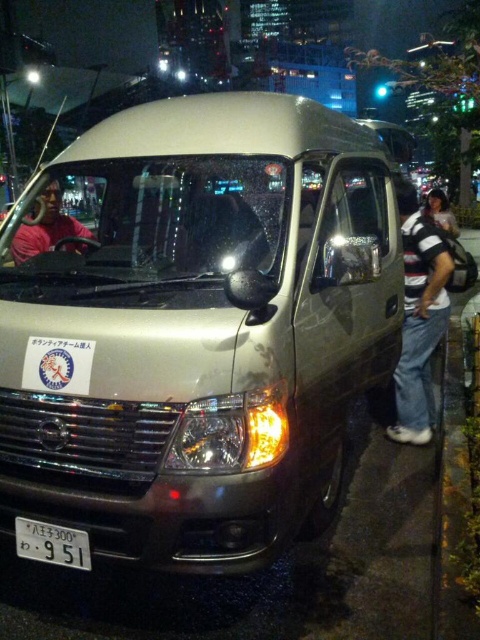
Question: From the image, what is the correct spatial relationship of transparent glass windshield at center in relation to matte black jacket at right?

Choices:
 (A) below
 (B) above

Answer: (A)

Question: Which point is farther from the camera taking this photo?

Choices:
 (A) (406, 317)
 (B) (36, 525)
 (C) (17, 264)
 (D) (36, 244)

Answer: (A)

Question: Among these objects, which one is nearest to the camera?

Choices:
 (A) black plastic license plate at lower center
 (B) transparent glass windshield at center
 (C) matte black jacket at right

Answer: (A)

Question: Where is transparent glass windshield at center located in relation to striped cotton shirt at right in the image?

Choices:
 (A) right
 (B) left

Answer: (B)

Question: Which point is closer to the camera?

Choices:
 (A) black plastic license plate at lower center
 (B) pink matte shirt at driver's seat
 (C) transparent glass windshield at center

Answer: (A)

Question: Does pink matte shirt at driver's seat appear over black plastic license plate at lower center?

Choices:
 (A) yes
 (B) no

Answer: (A)